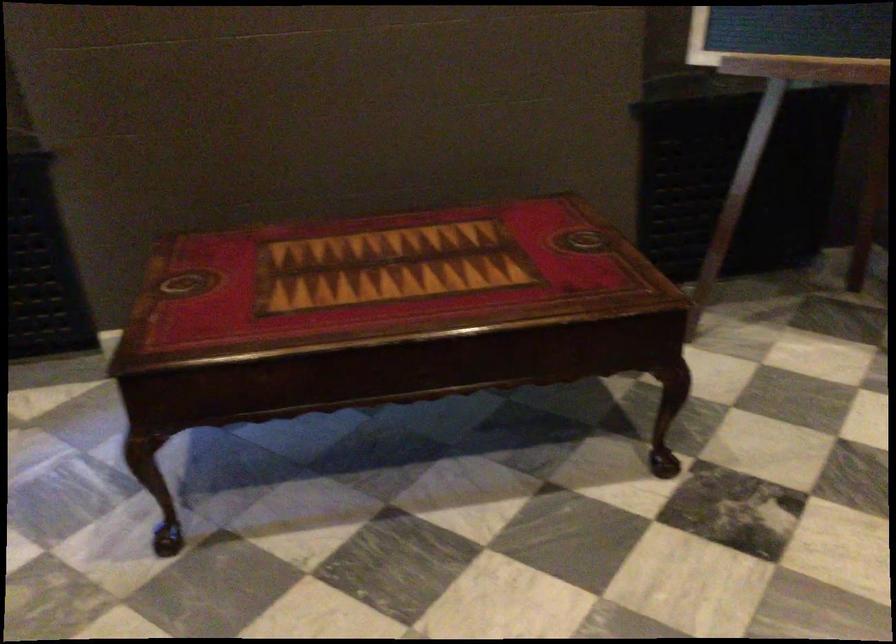
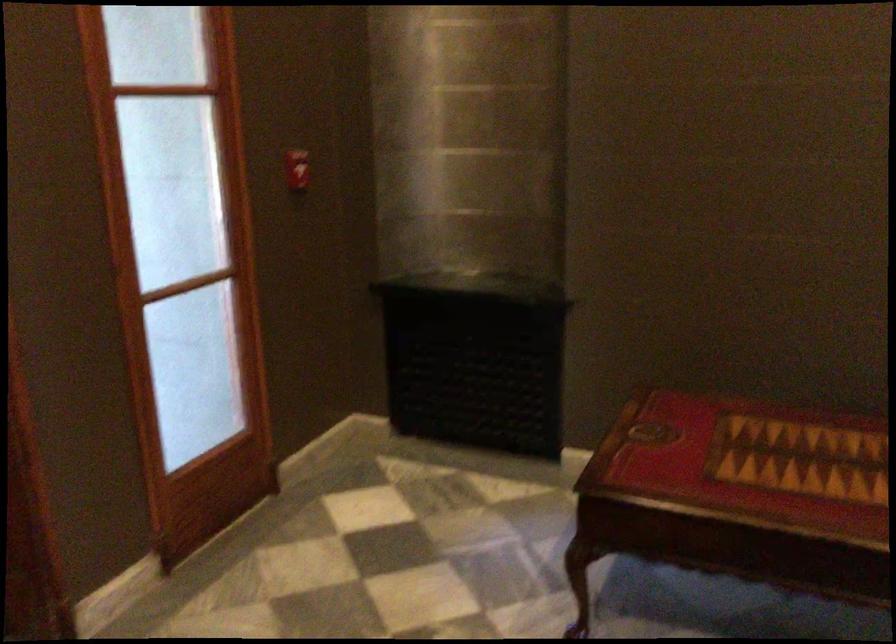
Question: Based on the continuous images, in which direction is the camera rotating? Reply with the corresponding letter.

Choices:
 (A) Left
 (B) Right
 (C) Up
 (D) Down

Answer: (A)